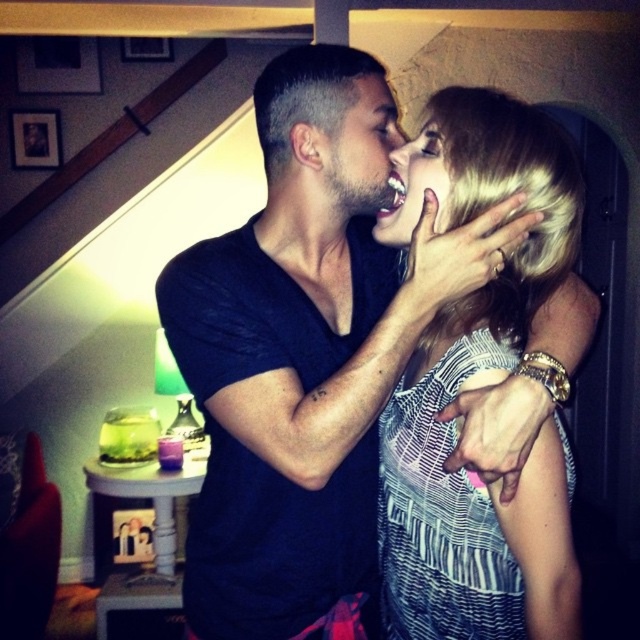
From the picture: Does striped fabric dress at center have a larger size compared to matte black beard at center?

Correct, striped fabric dress at center is larger in size than matte black beard at center.

Is the position of striped fabric dress at center less distant than that of matte black beard at center?

Yes, striped fabric dress at center is closer to the viewer.

This screenshot has width=640, height=640. Find the location of `striped fabric dress at center`. striped fabric dress at center is located at coordinates click(480, 387).

Who is shorter, matte black shirt at center or matte skin face at center?

With less height is matte skin face at center.

At what (x,y) coordinates should I click in order to perform the action: click on matte black shirt at center. Please return your answer as a coordinate pair (x, y). Looking at the image, I should click on (301, 371).

Locate an element on the screen. This screenshot has height=640, width=640. matte black shirt at center is located at coordinates (301, 371).

Based on the photo, can you confirm if matte black shirt at center is smaller than matte black beard at center?

No, matte black shirt at center is not smaller than matte black beard at center.

Where is `matte black shirt at center`? matte black shirt at center is located at coordinates (301, 371).